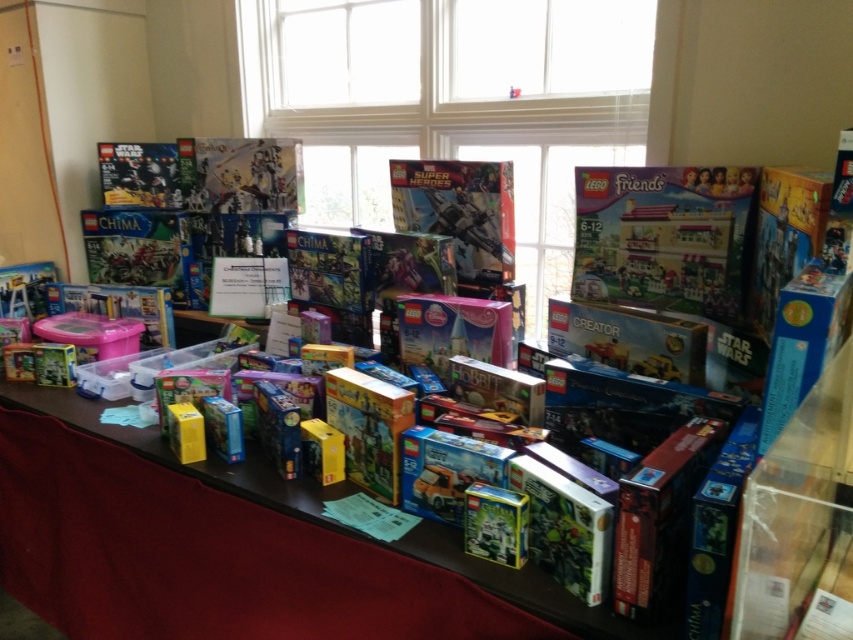
Question: Which object is positioned closest to the matte blue box at center?

Choices:
 (A) matte plastic toy at center
 (B) matte plastic lego friends set at center-right

Answer: (B)

Question: Does wooden table at center have a smaller size compared to matte blue box at center?

Choices:
 (A) yes
 (B) no

Answer: (B)

Question: Is matte plastic lego friends set at center-right above matte plastic comic book at center?

Choices:
 (A) yes
 (B) no

Answer: (B)

Question: Which of the following is the farthest from the observer?

Choices:
 (A) (311, 497)
 (B) (248, 147)
 (C) (573, 298)

Answer: (B)

Question: Is matte plastic comic book at center further to camera compared to metallic silver spaceship at center?

Choices:
 (A) yes
 (B) no

Answer: (A)

Question: Which of these objects is positioned closest to the matte blue box at center?

Choices:
 (A) matte plastic lego friends set at center-right
 (B) matte plastic toy at center

Answer: (A)